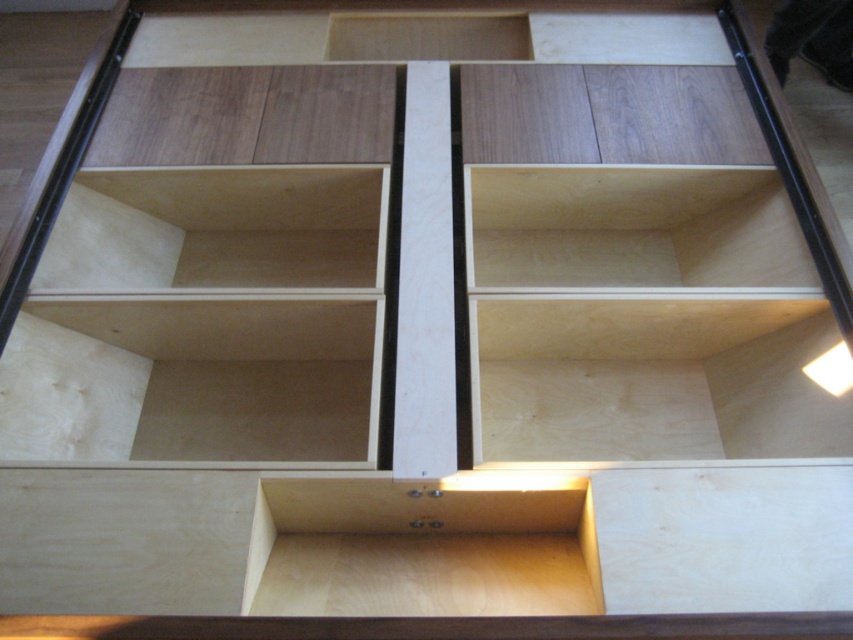
You are a carpenter inspecting a wooden shelving unit. You notice a point marked at coordinates (218, 228). Based on the scene described, which object does this point correspond to?

The point at coordinates (218, 228) corresponds to the light wood unfinished wood shelf at upper left.